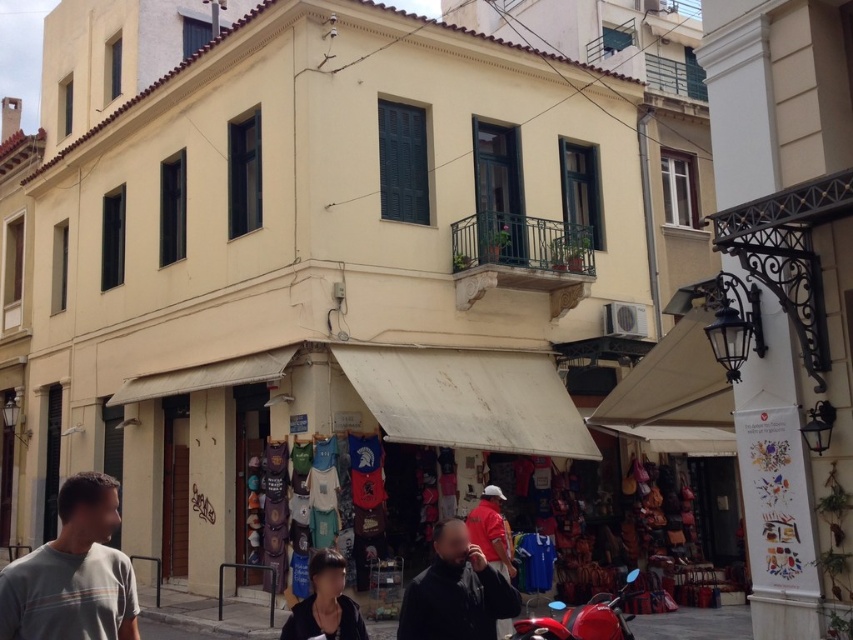
Is dark blue fabric at center to the right of shiny red motorcycle at lower right from the viewer's perspective?

No, dark blue fabric at center is not to the right of shiny red motorcycle at lower right.

Identify the location of dark blue fabric at center. This screenshot has height=640, width=853. (325, 604).

Is point (483, 556) more distant than point (477, 531)?

No, it is not.

From the picture: Is dark matte jacket at center further to the viewer compared to red cotton shirt at center?

No, dark matte jacket at center is in front of red cotton shirt at center.

Consider the image. Who is more forward, (x=425, y=609) or (x=479, y=513)?

Point (x=425, y=609) is in front.

Image resolution: width=853 pixels, height=640 pixels. Identify the location of dark matte jacket at center. (456, 592).

Is gray striped shirt at lower left positioned before dark blue fabric at center?

Yes, gray striped shirt at lower left is closer to the viewer.

Does gray striped shirt at lower left have a lesser width compared to dark blue fabric at center?

Correct, gray striped shirt at lower left's width is less than dark blue fabric at center's.

Is point (83, 563) positioned in front of point (321, 576)?

Yes, point (83, 563) is in front of point (321, 576).

Image resolution: width=853 pixels, height=640 pixels. I want to click on gray striped shirt at lower left, so click(x=73, y=572).